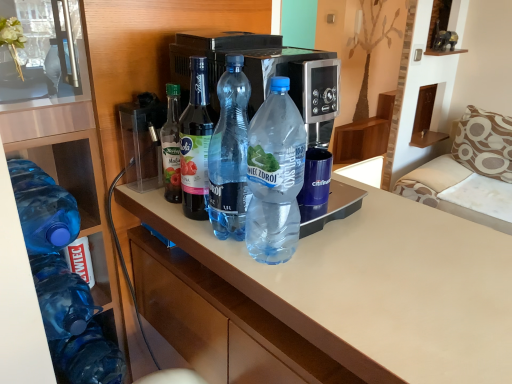
You are a GUI agent. You are given a task and a screenshot of the screen. Output one action in this format:
    pyautogui.click(x=<x>, y=<y>)
    Task: Click on the vacant point to the right of blue translucent bottle at center, which is counted as the 5th bottle, starting from the left
    The height and width of the screenshot is (384, 512).
    Given the screenshot: What is the action you would take?
    pyautogui.click(x=362, y=255)